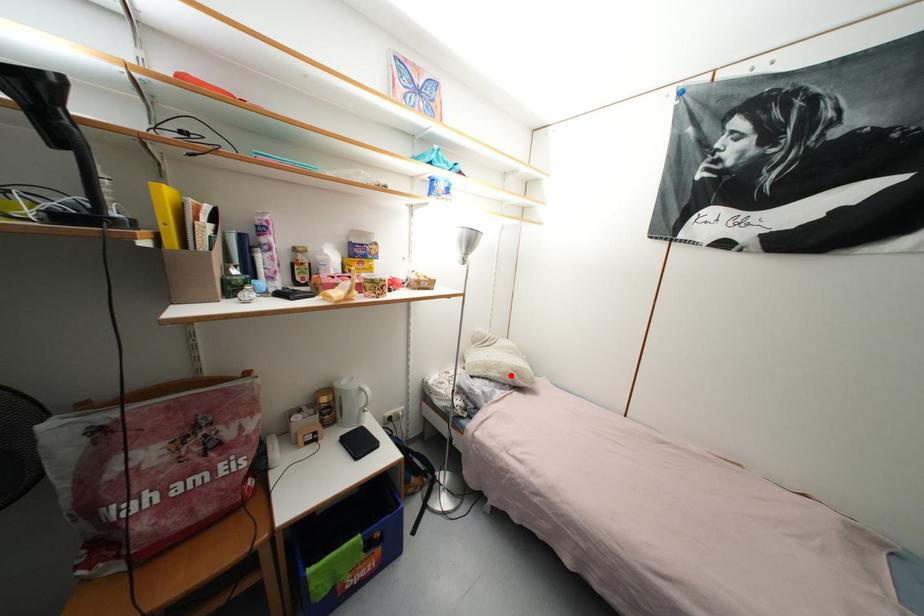
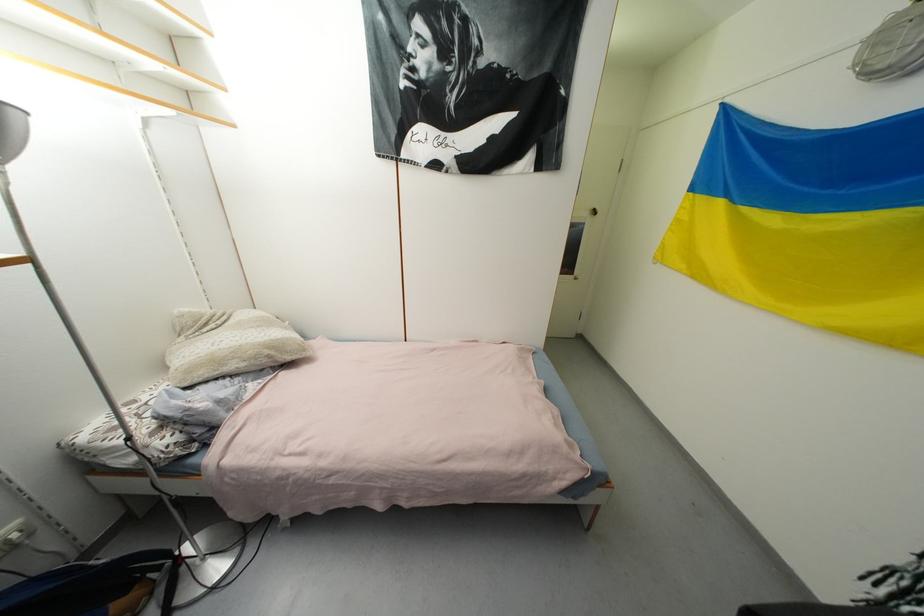
In the second image, find the point that corresponds to the highlighted location in the first image.

(261, 359)